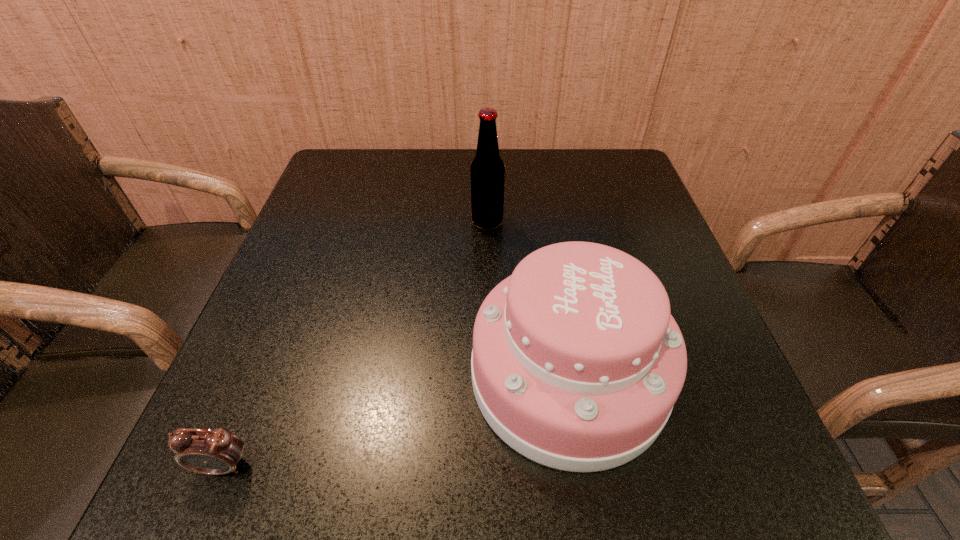
The width and height of the screenshot is (960, 540). In order to click on the tallest object in this screenshot , I will do `click(487, 172)`.

Locate an element on the screen. beer bottle is located at coordinates (487, 172).

Identify the location of birthday cake. (577, 362).

At what (x,y) coordinates should I click in order to perform the action: click on the shortest object. Please return your answer as a coordinate pair (x, y). This screenshot has width=960, height=540. Looking at the image, I should click on (208, 451).

The image size is (960, 540). What are the coordinates of `the leftmost object` in the screenshot? It's located at (208, 451).

At what (x,y) coordinates should I click in order to perform the action: click on vacant space located on the right of the tallest object. Please return your answer as a coordinate pair (x, y). The width and height of the screenshot is (960, 540). Looking at the image, I should click on (638, 222).

The width and height of the screenshot is (960, 540). Find the location of `free space located on the back of the birthday cake`. free space located on the back of the birthday cake is located at coordinates (547, 248).

The height and width of the screenshot is (540, 960). What are the coordinates of `birthday cake situated at the near edge` in the screenshot? It's located at (577, 362).

Locate an element on the screen. This screenshot has height=540, width=960. alarm clock that is at the near edge is located at coordinates (208, 451).

Identify the location of object that is positioned at the left edge. (208, 451).